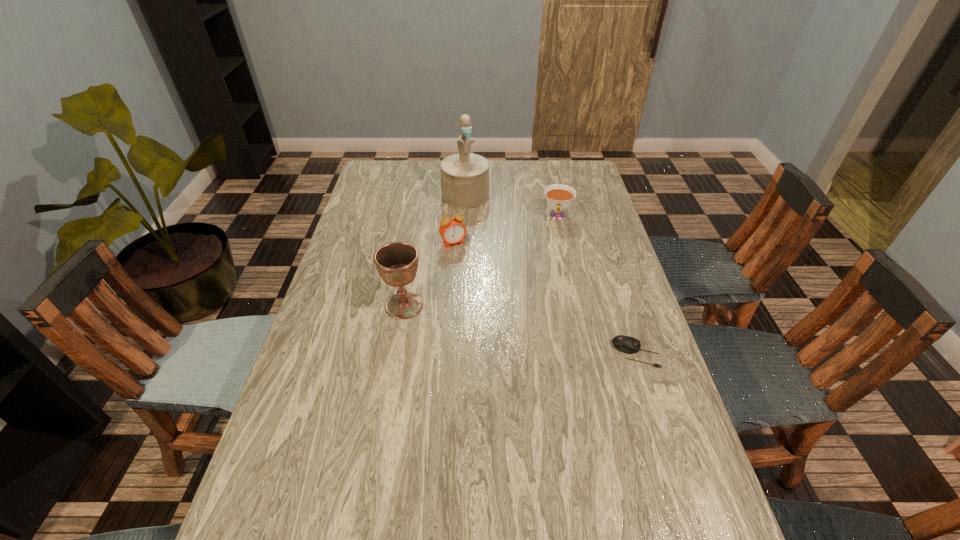
The height and width of the screenshot is (540, 960). In order to click on the second tallest object in this screenshot , I will do `click(396, 262)`.

The height and width of the screenshot is (540, 960). I want to click on the leftmost object, so click(x=396, y=262).

Locate an element on the screen. mouse is located at coordinates (626, 344).

Where is `the rightmost object`? Image resolution: width=960 pixels, height=540 pixels. the rightmost object is located at coordinates tap(626, 344).

Identify the location of the second object from right to left. Image resolution: width=960 pixels, height=540 pixels. (559, 197).

Locate an element on the screen. The width and height of the screenshot is (960, 540). the fourth tallest object is located at coordinates (559, 197).

The height and width of the screenshot is (540, 960). I want to click on figurine, so click(464, 176).

This screenshot has width=960, height=540. I want to click on the third farthest object, so click(x=452, y=230).

Image resolution: width=960 pixels, height=540 pixels. I want to click on the third shortest object, so click(452, 230).

The image size is (960, 540). I want to click on free space located 0.360m on the front of the chalice, so click(380, 446).